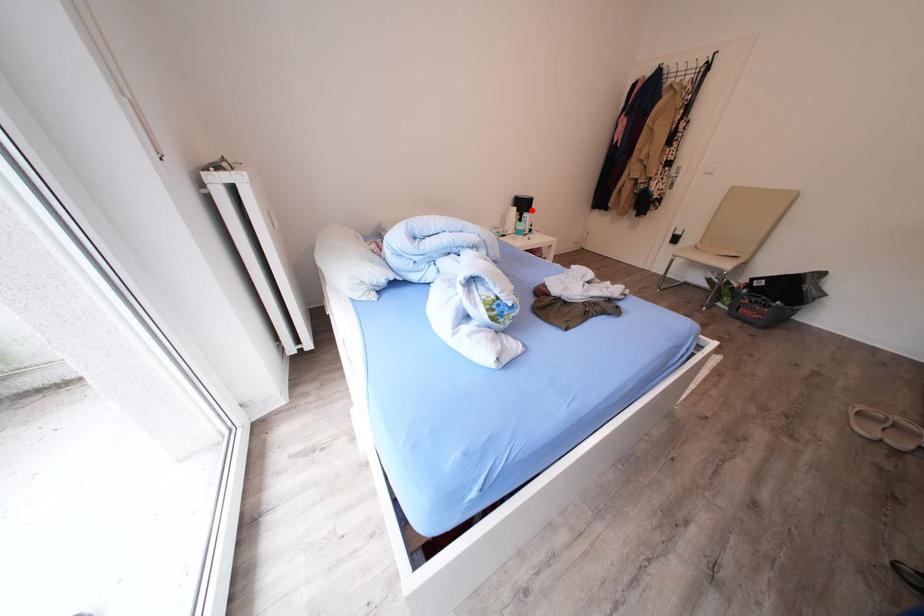
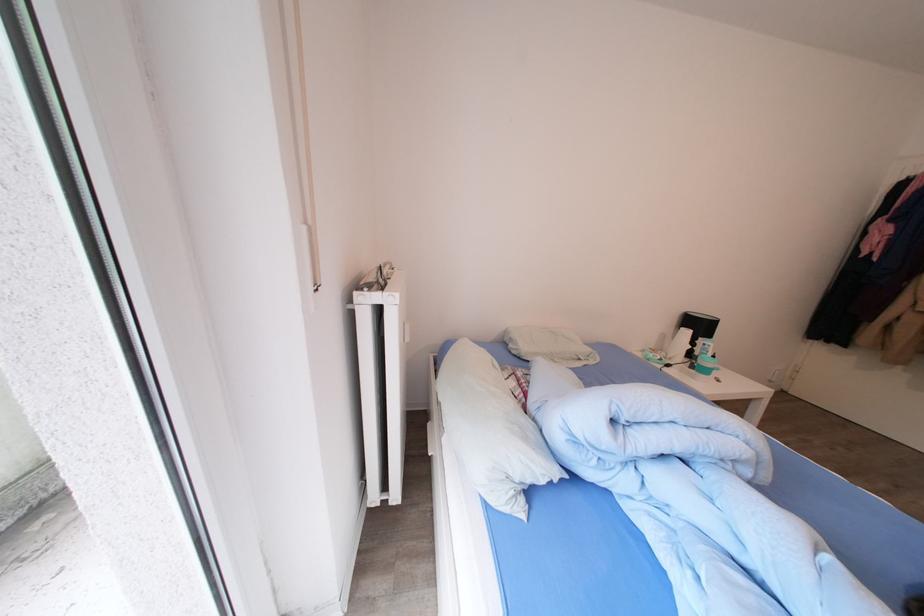
The point at the highlighted location is marked in the first image. Where is the corresponding point in the second image?

(708, 331)